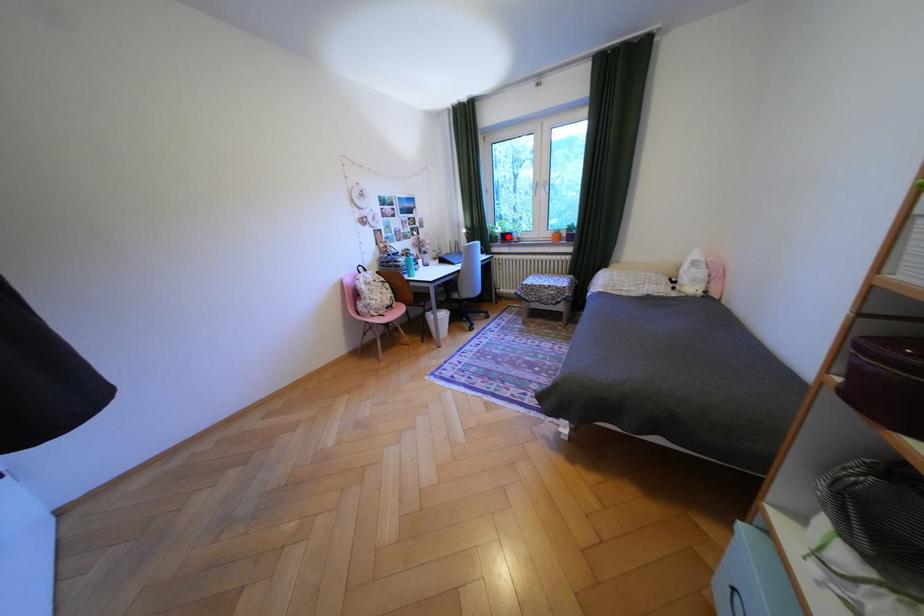
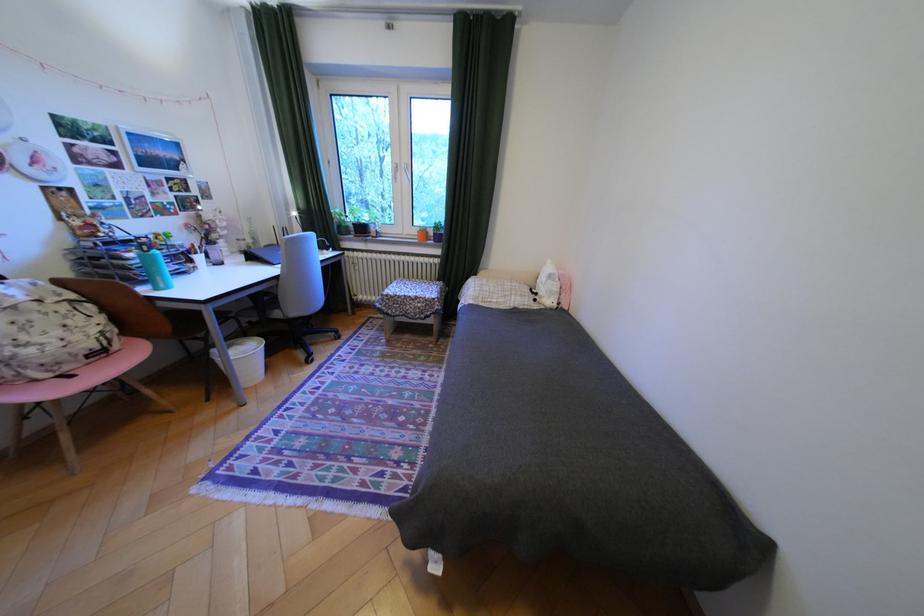
In the second image, find the point that corresponds to the highlighted location in the first image.

(359, 227)